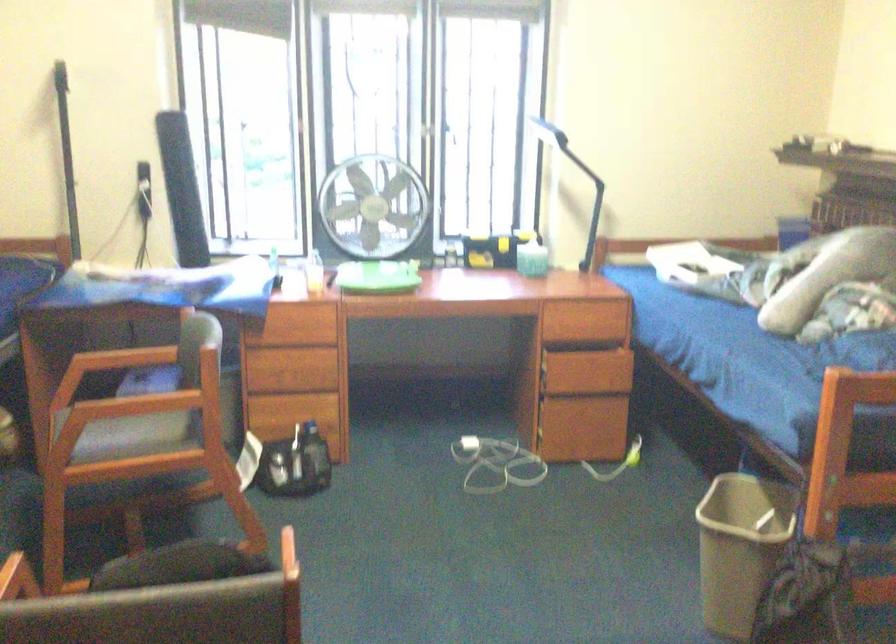
This screenshot has height=644, width=896. What do you see at coordinates (156, 427) in the screenshot?
I see `a wooden chair sitting surface` at bounding box center [156, 427].